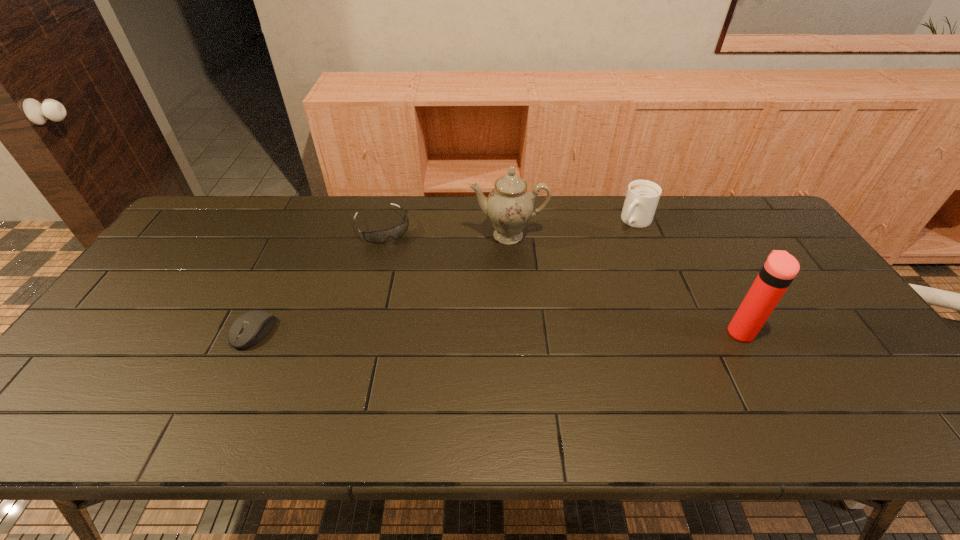
Find the location of a particular element. The height and width of the screenshot is (540, 960). vacant spot on the desktop that is between the shortest object and the thermos bottle and is positioned on the spout of the chinaware is located at coordinates (510, 332).

You are a GUI agent. You are given a task and a screenshot of the screen. Output one action in this format:
    pyautogui.click(x=<x>, y=<y>)
    Task: Click on the vacant space on the desktop that is between the computer equipment and the rightmost object and is positioned on the lenses of the fourth tallest object
    This screenshot has height=540, width=960.
    Given the screenshot: What is the action you would take?
    pyautogui.click(x=440, y=332)

What are the coordinates of `free space on the desktop that is between the computer equipment and the thermos bottle and is positioned on the side with the handle of the cappuccino` in the screenshot? It's located at (532, 332).